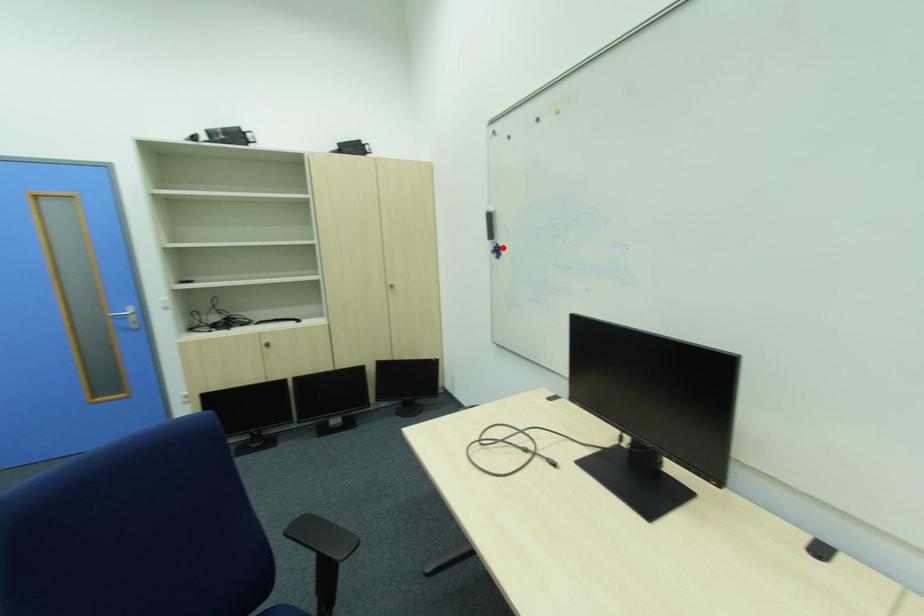
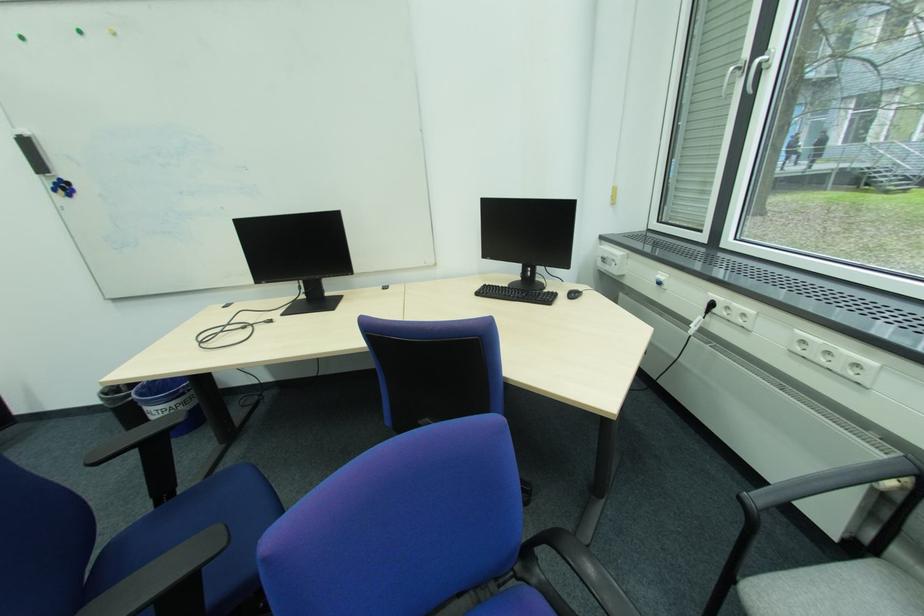
Question: I am providing you with two images of the same scene from different viewpoints. In image1, a red point is highlighted. Considering the same 3D point in image2, which of the following is correct?

Choices:
 (A) It is closer
 (B) It is farther

Answer: (B)